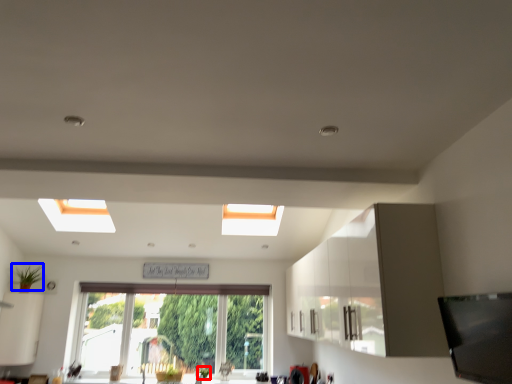
Question: Among these objects, which one is nearest to the camera, plant (highlighted by a red box) or plant (highlighted by a blue box)?

Choices:
 (A) plant
 (B) plant

Answer: (B)